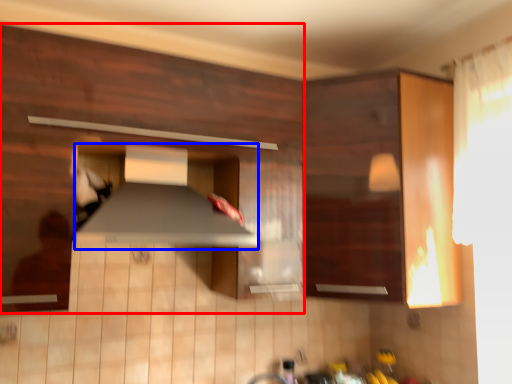
Question: Which of the following is the farthest to the observer, cabinetry (highlighted by a red box) or exhaust hood (highlighted by a blue box)?

Choices:
 (A) cabinetry
 (B) exhaust hood

Answer: (B)